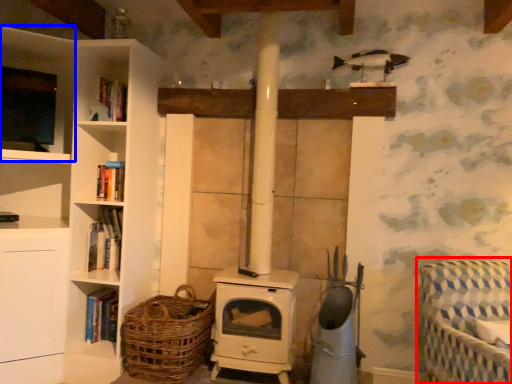
Question: Among these objects, which one is nearest to the camera, rocking chair (highlighted by a red box) or shelf (highlighted by a blue box)?

Choices:
 (A) rocking chair
 (B) shelf

Answer: (A)